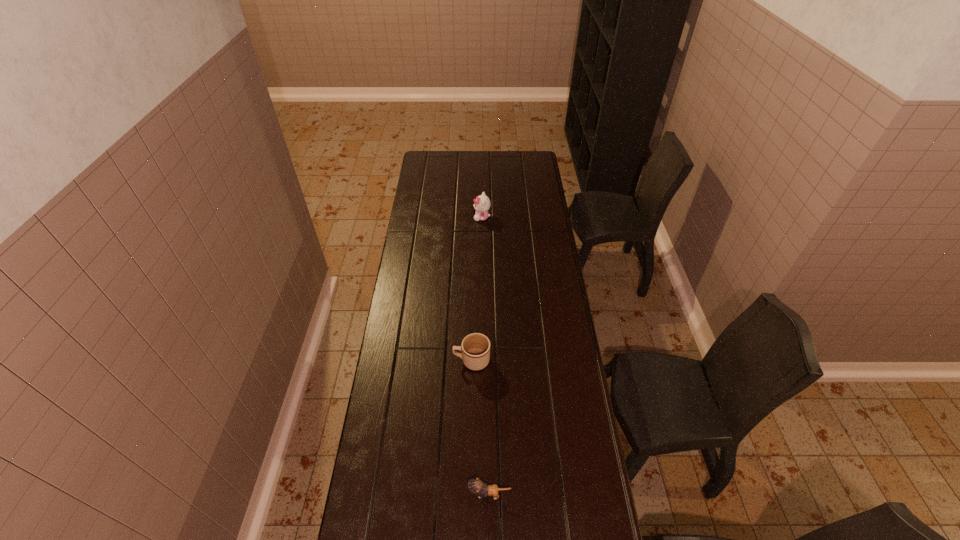
You are a GUI agent. You are given a task and a screenshot of the screen. Output one action in this format:
    pyautogui.click(x=<x>, y=<y>)
    Task: Click on the free space between the taller kitten and the second nearest object
    
    Given the screenshot: What is the action you would take?
    pyautogui.click(x=477, y=289)

Locate an element on the screen. free spot between the second tallest object and the farther kitten is located at coordinates (477, 289).

Where is `vacant area that lies between the nearest object and the second tallest object`? The width and height of the screenshot is (960, 540). vacant area that lies between the nearest object and the second tallest object is located at coordinates 480,427.

You are a GUI agent. You are given a task and a screenshot of the screen. Output one action in this format:
    pyautogui.click(x=<x>, y=<y>)
    Task: Click on the free area in between the tallest object and the second tallest object
    
    Given the screenshot: What is the action you would take?
    pyautogui.click(x=477, y=289)

I want to click on free point between the second tallest object and the shortest object, so click(480, 427).

The height and width of the screenshot is (540, 960). Identify the location of empty space between the tallest object and the second nearest object. (477, 289).

At what (x,y) coordinates should I click in order to perform the action: click on free spot between the shorter kitten and the mug. Please return your answer as a coordinate pair (x, y). Looking at the image, I should click on (480, 427).

I want to click on vacant space that's between the second shortest object and the farther kitten, so click(x=477, y=289).

Locate which object ranks second in proximity to the nearest object. Please provide its 2D coordinates. Your answer should be formatted as a tuple, i.e. [(x, y)], where the tuple contains the x and y coordinates of a point satisfying the conditions above.

[(482, 203)]

Locate which object ranks in proximity to the mug. Please provide its 2D coordinates. Your answer should be formatted as a tuple, i.e. [(x, y)], where the tuple contains the x and y coordinates of a point satisfying the conditions above.

[(477, 486)]